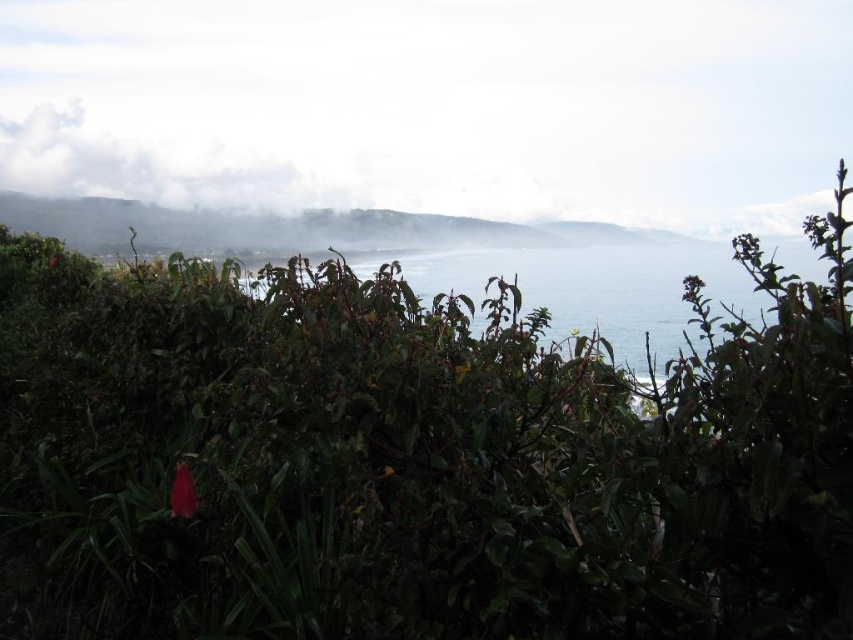
Is green leafy bush at center closer to camera compared to white misty cloud at upper center?

Yes, green leafy bush at center is closer to the viewer.

Does green leafy bush at center appear on the right side of white misty cloud at upper center?

Incorrect, green leafy bush at center is not on the right side of white misty cloud at upper center.

Who is more forward, (242, 438) or (485, 192)?

Positioned in front is point (242, 438).

In order to click on green leafy bush at center in this screenshot , I will do `click(412, 458)`.

Is green leafy bush at center shorter than white fluffy cloud at upper left?

Correct, green leafy bush at center is not as tall as white fluffy cloud at upper left.

Is point (647, 429) positioned after point (51, 132)?

No, (647, 429) is in front of (51, 132).

Between point (91, 408) and point (86, 172), which one is positioned behind?

The point (86, 172) is more distant.

Locate an element on the screen. green leafy bush at center is located at coordinates (412, 458).

Which of these two, blue water at center or white fluffy cloud at upper left, stands shorter?

Standing shorter between the two is blue water at center.

Between blue water at center and white fluffy cloud at upper left, which one appears on the left side from the viewer's perspective?

Positioned to the left is white fluffy cloud at upper left.

Is point (764, 321) less distant than point (113, 189)?

Yes.

The image size is (853, 640). Find the location of `blue water at center`. blue water at center is located at coordinates (596, 291).